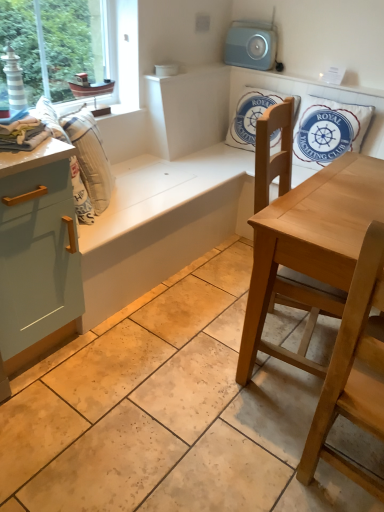
What do you see at coordinates (90, 157) in the screenshot? The width and height of the screenshot is (384, 512). I see `white striped fabric at left` at bounding box center [90, 157].

The height and width of the screenshot is (512, 384). Describe the element at coordinates (250, 116) in the screenshot. I see `white cotton cushion at upper center, which ranks as the 2th pillow in right-to-left order` at that location.

You are a GUI agent. You are given a task and a screenshot of the screen. Output one action in this format:
    pyautogui.click(x=<x>, y=<y>)
    Task: Click on the white cotton cushion at upper right, arranged as the second pillow when viewed from the left
    Image resolution: width=384 pixels, height=512 pixels.
    Given the screenshot: What is the action you would take?
    pyautogui.click(x=327, y=130)

Locate an element on the screen. The width and height of the screenshot is (384, 512). light wood chair at center, which is the first chair in back-to-front order is located at coordinates (306, 242).

At what (x,y) coordinates should I click in order to perform the action: click on white striped fabric at left. Please return your answer as a coordinate pair (x, y). Image resolution: width=384 pixels, height=512 pixels. Looking at the image, I should click on (90, 157).

Considering the relative sizes of light blue matte cabinet at left and light wood chair at lower right, acting as the 2th chair starting from the back, in the image provided, is light blue matte cabinet at left wider than light wood chair at lower right, acting as the 2th chair starting from the back,?

Indeed, light blue matte cabinet at left has a greater width compared to light wood chair at lower right, acting as the 2th chair starting from the back.

Is light blue matte cabinet at left not close to light wood chair at lower right, marked as the 1th chair in a front-to-back arrangement?

Yes, light blue matte cabinet at left is far from light wood chair at lower right, marked as the 1th chair in a front-to-back arrangement.

Which is in front, point (22, 261) or point (353, 395)?

The point (353, 395) is more forward.

In the scene shown: Relative to white cotton cushion at upper center, which ranks as the 2th pillow in right-to-left order, is white cotton cushion at upper right, the 1th pillow viewed from the right, in front or behind?

white cotton cushion at upper right, the 1th pillow viewed from the right, is positioned closer to the viewer than white cotton cushion at upper center, which ranks as the 2th pillow in right-to-left order.

Can you tell me how much white cotton cushion at upper right, the 1th pillow viewed from the right, and white cotton cushion at upper center, which ranks as the 2th pillow in right-to-left order, differ in facing direction?

There is a 2.79-degree angle between the facing directions of white cotton cushion at upper right, the 1th pillow viewed from the right, and white cotton cushion at upper center, which ranks as the 2th pillow in right-to-left order.

Is point (327, 114) positioned before point (253, 149)?

Yes, point (327, 114) is in front of point (253, 149).

Identify the location of chair that is the 2nd one when counting forward from the light blue plastic radio at upper center. Image resolution: width=384 pixels, height=512 pixels. (353, 370).

Does light blue plastic radio at upper center turn towards light wood chair at lower right, marked as the 1th chair in a front-to-back arrangement?

No, light blue plastic radio at upper center is not oriented towards light wood chair at lower right, marked as the 1th chair in a front-to-back arrangement.

Is the surface of light blue plastic radio at upper center in direct contact with light wood chair at lower right, marked as the 1th chair in a front-to-back arrangement?

No.

Which object is closer to the camera taking this photo, light blue plastic radio at upper center or light wood chair at lower right, acting as the 2th chair starting from the back?

Positioned in front is light wood chair at lower right, acting as the 2th chair starting from the back.

What's the angular difference between light wood chair at center, which is the first chair in back-to-front order, and white cotton cushion at upper right, arranged as the second pillow when viewed from the left,'s facing directions?

The angle between the facing direction of light wood chair at center, which is the first chair in back-to-front order, and the facing direction of white cotton cushion at upper right, arranged as the second pillow when viewed from the left, is 106 degrees.

From a real-world perspective, is light wood chair at center, which is the first chair in back-to-front order, under white cotton cushion at upper right, the 1th pillow viewed from the right?

Yes, from a real-world perspective, light wood chair at center, which is the first chair in back-to-front order, is below white cotton cushion at upper right, the 1th pillow viewed from the right.

Is light wood chair at center, marked as the 2th chair in a front-to-back arrangement, shorter than white cotton cushion at upper right, the 1th pillow viewed from the right?

No.

Considering the relative sizes of light wood chair at center, which is the first chair in back-to-front order, and white cotton cushion at upper right, arranged as the second pillow when viewed from the left, in the image provided, is light wood chair at center, which is the first chair in back-to-front order, bigger than white cotton cushion at upper right, arranged as the second pillow when viewed from the left,?

Yes.

Can you tell me how much light blue plastic radio at upper center and light wood chair at center, marked as the 2th chair in a front-to-back arrangement, differ in facing direction?

The facing directions of light blue plastic radio at upper center and light wood chair at center, marked as the 2th chair in a front-to-back arrangement, are 105 degrees apart.

Is light blue plastic radio at upper center facing away from light wood chair at center, marked as the 2th chair in a front-to-back arrangement?

No, light blue plastic radio at upper center is not facing the opposite direction of light wood chair at center, marked as the 2th chair in a front-to-back arrangement.

From a real-world perspective, which object stands above the other?

light blue plastic radio at upper center is physically above.

Is light blue plastic radio at upper center positioned in front of white striped fabric at left?

No, it is behind white striped fabric at left.

What's the angular difference between light blue plastic radio at upper center and white striped fabric at left's facing directions?

They differ by 130 degrees in their facing directions.

From the picture: Is light blue plastic radio at upper center smaller than white striped fabric at left?

Indeed, light blue plastic radio at upper center has a smaller size compared to white striped fabric at left.

Does light blue plastic radio at upper center have a greater height compared to white striped fabric at left?

No, light blue plastic radio at upper center is not taller than white striped fabric at left.

How much distance is there between light blue matte cabinet at left and light blue plastic radio at upper center?

6.38 feet.

Can you see light blue matte cabinet at left touching light blue plastic radio at upper center?

No, light blue matte cabinet at left is not next to light blue plastic radio at upper center.

In terms of size, does light blue matte cabinet at left appear bigger or smaller than light blue plastic radio at upper center?

Considering their sizes, light blue matte cabinet at left takes up more space than light blue plastic radio at upper center.

Is light blue matte cabinet at left aimed at light blue plastic radio at upper center?

No.

Locate an element on the screen. cabinetry behind the light wood chair at lower right, marked as the 1th chair in a front-to-back arrangement is located at coordinates (37, 246).

Where is `pillow above the white cotton cushion at upper center, arranged as the first pillow when viewed from the left (from a real-world perspective)`? This screenshot has width=384, height=512. pillow above the white cotton cushion at upper center, arranged as the first pillow when viewed from the left (from a real-world perspective) is located at coordinates (327, 130).

Estimate the real-world distances between objects in this image. Which object is closer to white striped fabric at left, white cotton towel at left or white cotton cushion at upper center, arranged as the first pillow when viewed from the left?

The object closer to white striped fabric at left is white cotton towel at left.

Looking at the image, which one is located closer to white striped fabric at left, light wood chair at center, which is the first chair in back-to-front order, or white cotton towel at left?

white cotton towel at left lies closer to white striped fabric at left than the other object.

Consider the image. Considering their positions, is white cotton towel at left positioned closer to light wood chair at lower right, acting as the 2th chair starting from the back, than light blue matte cabinet at left?

Among the two, light blue matte cabinet at left is located nearer to light wood chair at lower right, acting as the 2th chair starting from the back.

Which object lies nearer to the anchor point white striped fabric at left, white cotton towel at left or white cotton cushion at upper right, arranged as the second pillow when viewed from the left?

The object closer to white striped fabric at left is white cotton towel at left.

In the scene shown: From the image, which object appears to be farther from light wood chair at center, which is the first chair in back-to-front order, white cotton cushion at upper right, the 1th pillow viewed from the right, or light blue matte cabinet at left?

light blue matte cabinet at left is positioned further to the anchor light wood chair at center, which is the first chair in back-to-front order.

When comparing their distances from light wood chair at center, marked as the 2th chair in a front-to-back arrangement, does white cotton cushion at upper center, arranged as the first pillow when viewed from the left, or light wood chair at lower right, marked as the 1th chair in a front-to-back arrangement, seem closer?

light wood chair at lower right, marked as the 1th chair in a front-to-back arrangement, is positioned closer to the anchor light wood chair at center, marked as the 2th chair in a front-to-back arrangement.

Which object lies nearer to the anchor point white cotton cushion at upper center, arranged as the first pillow when viewed from the left, light wood chair at lower right, acting as the 2th chair starting from the back, or light blue matte cabinet at left?

Among the two, light blue matte cabinet at left is located nearer to white cotton cushion at upper center, arranged as the first pillow when viewed from the left.

Considering their positions, is white cotton cushion at upper right, arranged as the second pillow when viewed from the left, positioned closer to light wood chair at lower right, marked as the 1th chair in a front-to-back arrangement, than light blue matte cabinet at left?

The object closer to light wood chair at lower right, marked as the 1th chair in a front-to-back arrangement, is light blue matte cabinet at left.

Identify the location of material between white striped fabric at left and light blue matte cabinet at left from top to bottom. This screenshot has width=384, height=512. (23, 134).

Where is `material located between light wood chair at center, marked as the 2th chair in a front-to-back arrangement, and white cotton cushion at upper center, arranged as the first pillow when viewed from the left, in the depth direction`? This screenshot has width=384, height=512. material located between light wood chair at center, marked as the 2th chair in a front-to-back arrangement, and white cotton cushion at upper center, arranged as the first pillow when viewed from the left, in the depth direction is located at coordinates (23, 134).

At what (x,y) coordinates should I click in order to perform the action: click on pillow between light wood chair at center, which is the first chair in back-to-front order, and white cotton cushion at upper center, which ranks as the 2th pillow in right-to-left order, in the front-back direction. Please return your answer as a coordinate pair (x, y). This screenshot has width=384, height=512. Looking at the image, I should click on (327, 130).

Where is `material between light wood chair at lower right, marked as the 1th chair in a front-to-back arrangement, and white cotton cushion at upper center, which ranks as the 2th pillow in right-to-left order, from front to back`? The height and width of the screenshot is (512, 384). material between light wood chair at lower right, marked as the 1th chair in a front-to-back arrangement, and white cotton cushion at upper center, which ranks as the 2th pillow in right-to-left order, from front to back is located at coordinates (23, 134).